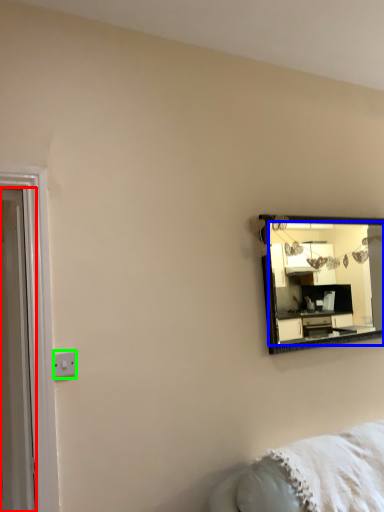
Question: Considering the real-world distances, which object is closest to door (highlighted by a red box)? mirror (highlighted by a blue box) or electric outlet (highlighted by a green box).

Choices:
 (A) mirror
 (B) electric outlet

Answer: (B)